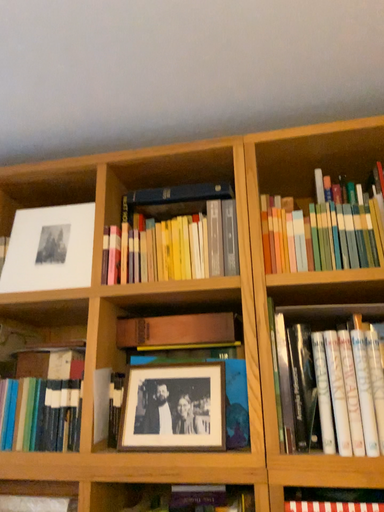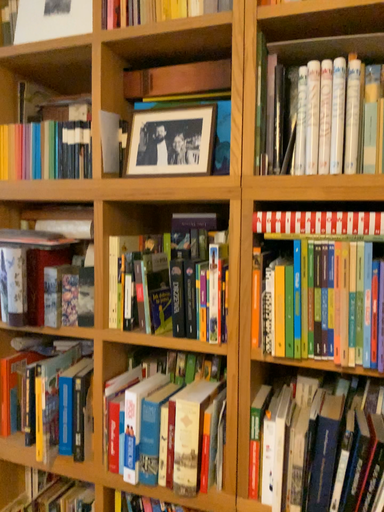
Question: Which way did the camera rotate in the video?

Choices:
 (A) rotated downward
 (B) rotated upward

Answer: (A)